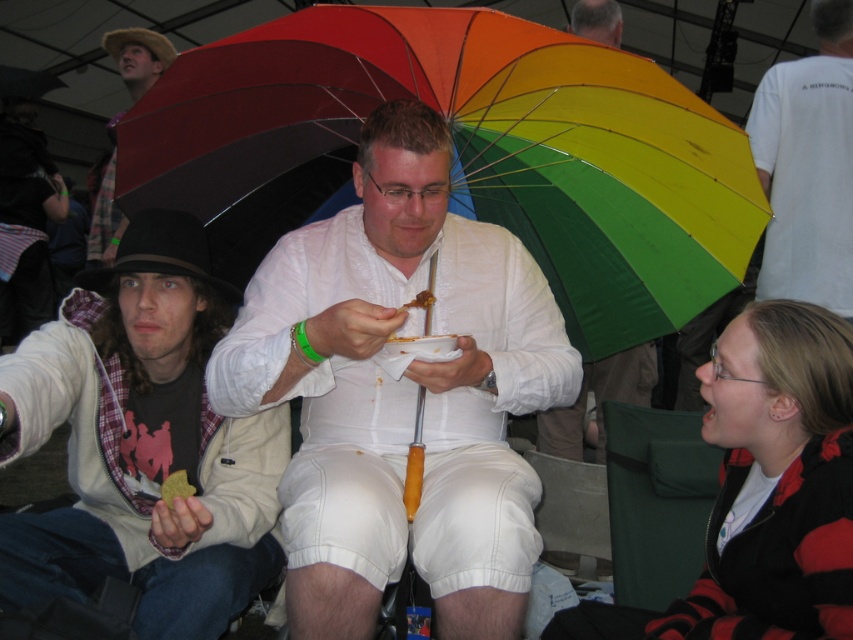
Does matte black hat at left have a smaller size compared to black and red striped sweater at lower right?

Incorrect, matte black hat at left is not smaller in size than black and red striped sweater at lower right.

Can you confirm if matte black hat at left is wider than black and red striped sweater at lower right?

Indeed, matte black hat at left has a greater width compared to black and red striped sweater at lower right.

This screenshot has height=640, width=853. Find the location of `matte black hat at left`. matte black hat at left is located at coordinates (142, 444).

You are a GUI agent. You are given a task and a screenshot of the screen. Output one action in this format:
    pyautogui.click(x=<x>, y=<y>)
    Task: Click on the matte black hat at left
    Image resolution: width=853 pixels, height=640 pixels.
    Given the screenshot: What is the action you would take?
    pyautogui.click(x=142, y=444)

Which is above, matte brown hat at upper left or brown crumbly at center?

matte brown hat at upper left is higher up.

What are the coordinates of `matte brown hat at upper left` in the screenshot? It's located at (138, 56).

Does black and red striped sweater at lower right have a lesser height compared to brown crumbly at center?

No.

From the picture: Is black and red striped sweater at lower right taller than brown crumbly at center?

Correct, black and red striped sweater at lower right is much taller as brown crumbly at center.

Where is `black and red striped sweater at lower right`? The image size is (853, 640). black and red striped sweater at lower right is located at coordinates (764, 490).